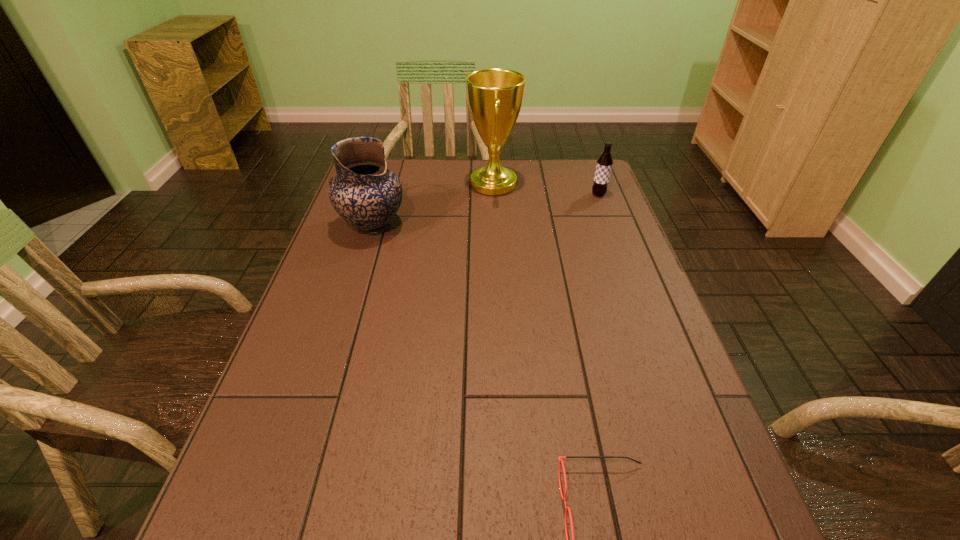
Identify the location of vacant space that satisfies the following two spatial constraints: 1. on the back side of the root beer; 2. by the handles of the tallest object. The height and width of the screenshot is (540, 960). (594, 184).

Where is `free space that satisfies the following two spatial constraints: 1. by the handles of the second shortest object; 2. on the left side of the award`? free space that satisfies the following two spatial constraints: 1. by the handles of the second shortest object; 2. on the left side of the award is located at coordinates (493, 194).

Identify the location of free region that satisfies the following two spatial constraints: 1. by the handles of the second object from left to right; 2. on the front side of the third shortest object. The height and width of the screenshot is (540, 960). (495, 226).

Identify the location of free location that satisfies the following two spatial constraints: 1. by the handles of the second object from left to right; 2. on the left side of the root beer. The height and width of the screenshot is (540, 960). tap(493, 194).